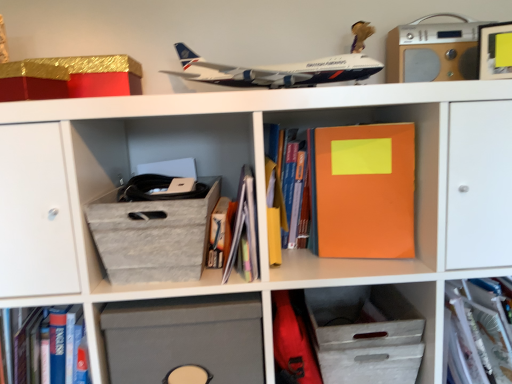
Question: Which direction should I rotate to face matte gray storage box at lower center, which is counted as the 2th cabinet, starting from the right, — up or down?

Choices:
 (A) up
 (B) down

Answer: (B)

Question: Which direction should I rotate to look at matte paper book at center, arranged as the third book when viewed from the right, — up or down?

Choices:
 (A) down
 (B) up

Answer: (A)

Question: Is orange matte notebook at center to the left of translucent plastic folder at center, which ranks as the 4th book in left-to-right order, from the viewer's perspective?

Choices:
 (A) yes
 (B) no

Answer: (A)

Question: Does orange matte notebook at center have a lesser width compared to translucent plastic folder at center, which ranks as the 4th book in left-to-right order?

Choices:
 (A) no
 (B) yes

Answer: (B)

Question: Can translucent plastic folder at center, which ranks as the 4th book in left-to-right order, be found inside orange matte notebook at center?

Choices:
 (A) no
 (B) yes

Answer: (A)

Question: Does orange matte notebook at center have a greater height compared to translucent plastic folder at center, the first book in the right-to-left sequence?

Choices:
 (A) yes
 (B) no

Answer: (A)

Question: Considering the relative sizes of orange matte notebook at center and translucent plastic folder at center, the first book in the right-to-left sequence, in the image provided, is orange matte notebook at center bigger than translucent plastic folder at center, the first book in the right-to-left sequence,?

Choices:
 (A) no
 (B) yes

Answer: (A)

Question: Considering the relative sizes of orange matte notebook at center and translucent plastic folder at center, which ranks as the 4th book in left-to-right order, in the image provided, is orange matte notebook at center shorter than translucent plastic folder at center, which ranks as the 4th book in left-to-right order,?

Choices:
 (A) yes
 (B) no

Answer: (B)

Question: Does wooden stereo at upper right lie in front of orange matte notebook at center?

Choices:
 (A) no
 (B) yes

Answer: (A)

Question: From a real-world perspective, is wooden stereo at upper right physically above orange matte notebook at center?

Choices:
 (A) yes
 (B) no

Answer: (A)

Question: Is wooden stereo at upper right far from orange matte notebook at center?

Choices:
 (A) no
 (B) yes

Answer: (A)

Question: Can you confirm if wooden stereo at upper right is thinner than orange matte notebook at center?

Choices:
 (A) no
 (B) yes

Answer: (A)

Question: Can you confirm if wooden stereo at upper right is bigger than orange matte notebook at center?

Choices:
 (A) no
 (B) yes

Answer: (B)

Question: Is wooden stereo at upper right facing towards orange matte notebook at center?

Choices:
 (A) yes
 (B) no

Answer: (B)

Question: Is hardcover book at center, positioned as the 2th book in right-to-left order, surrounded by orange matte notebook at center?

Choices:
 (A) yes
 (B) no

Answer: (B)